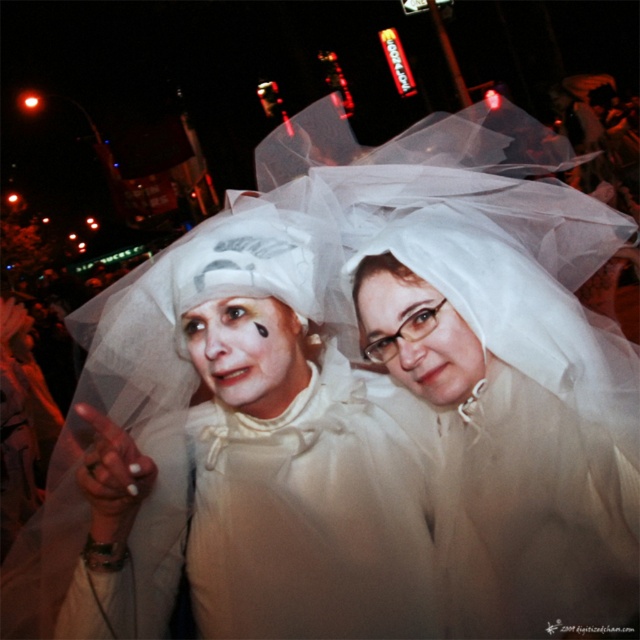
Question: Which point is farther to the camera?

Choices:
 (A) translucent white veil at center
 (B) white sheer veil at center

Answer: (A)

Question: Is white sheer veil at center positioned at the back of translucent white veil at center?

Choices:
 (A) no
 (B) yes

Answer: (A)

Question: Which object appears farthest from the camera in this image?

Choices:
 (A) white sheer veil at center
 (B) translucent white veil at center

Answer: (B)

Question: Observing the image, what is the correct spatial positioning of white sheer veil at center in reference to translucent white veil at center?

Choices:
 (A) right
 (B) left

Answer: (B)

Question: Which object is closer to the camera taking this photo?

Choices:
 (A) white sheer veil at center
 (B) translucent white veil at center

Answer: (A)

Question: Considering the relative positions of white sheer veil at center and translucent white veil at center in the image provided, where is white sheer veil at center located with respect to translucent white veil at center?

Choices:
 (A) left
 (B) right

Answer: (A)